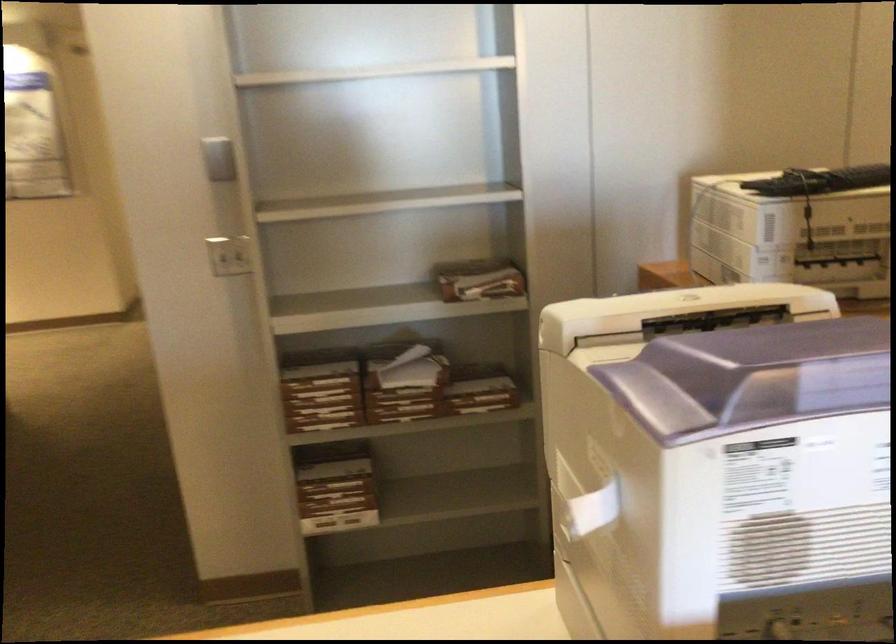
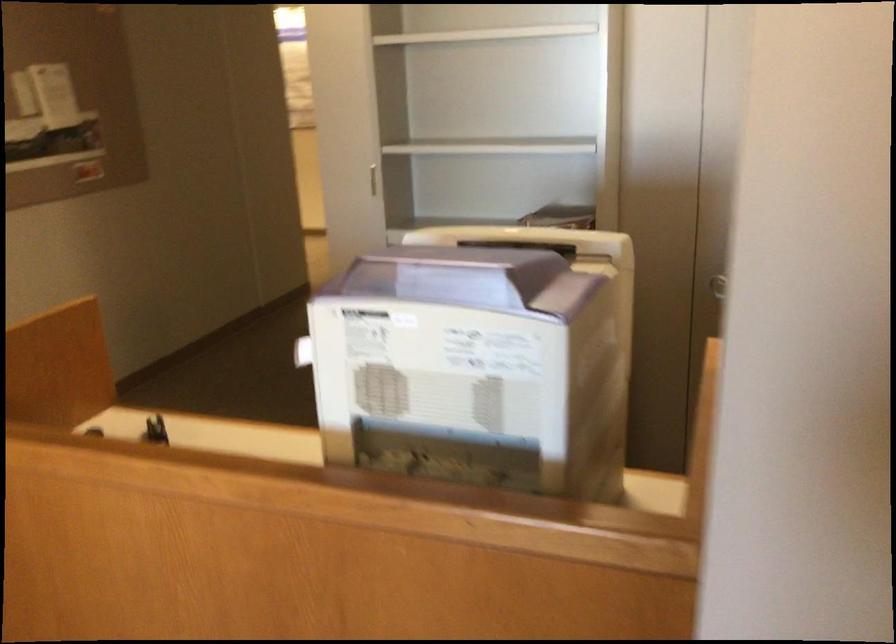
Question: The camera is either moving clockwise (left) or counter-clockwise (right) around the object. The first image is from the beginning of the video and the second image is from the end. Is the camera moving left or right when shooting the video?

Choices:
 (A) Left
 (B) Right

Answer: (B)